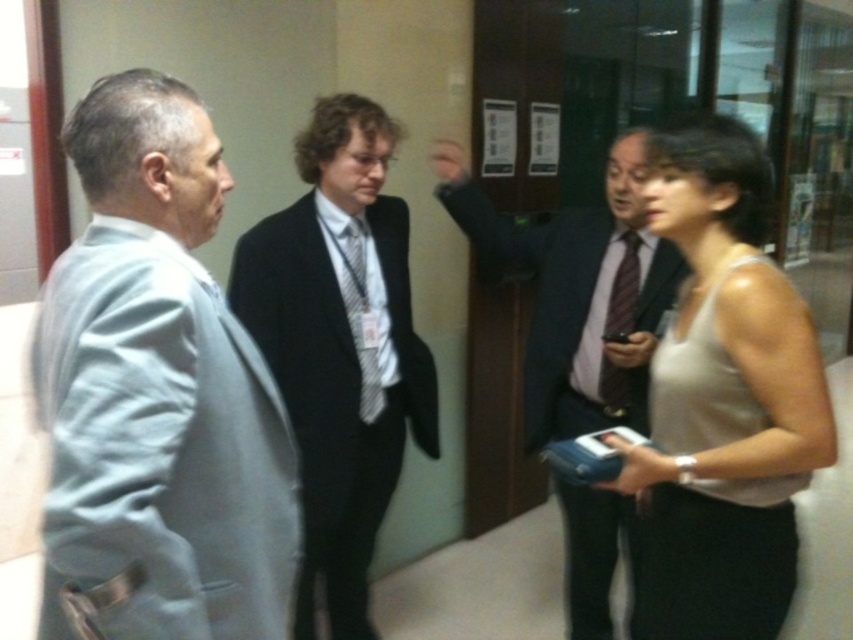
Question: Which object appears closest to the camera in this image?

Choices:
 (A) gray fabric suit at left
 (B) black suit at center
 (C) matte black suit at center

Answer: (A)

Question: Can you confirm if beige fabric tank top at right is positioned above matte black suit at center?

Choices:
 (A) yes
 (B) no

Answer: (B)

Question: Among these objects, which one is nearest to the camera?

Choices:
 (A) matte black suit at center
 (B) beige fabric tank top at right
 (C) gray fabric suit at left

Answer: (C)

Question: Which of the following is the closest to the observer?

Choices:
 (A) (204, 348)
 (B) (625, 320)
 (C) (727, 634)

Answer: (A)

Question: Can you confirm if black suit at center is wider than matte black suit at center?

Choices:
 (A) no
 (B) yes

Answer: (A)

Question: Is gray fabric suit at left below matte black suit at center?

Choices:
 (A) no
 (B) yes

Answer: (B)